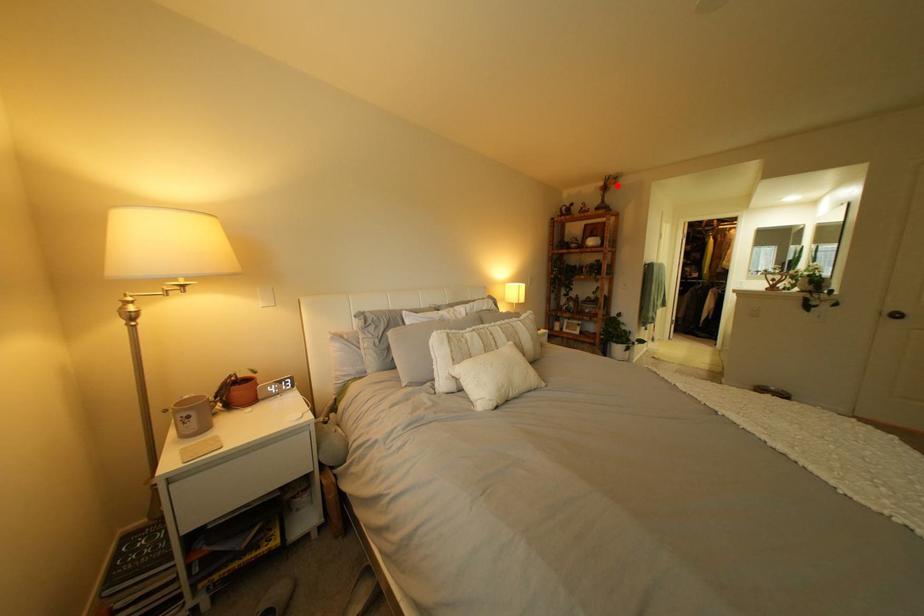
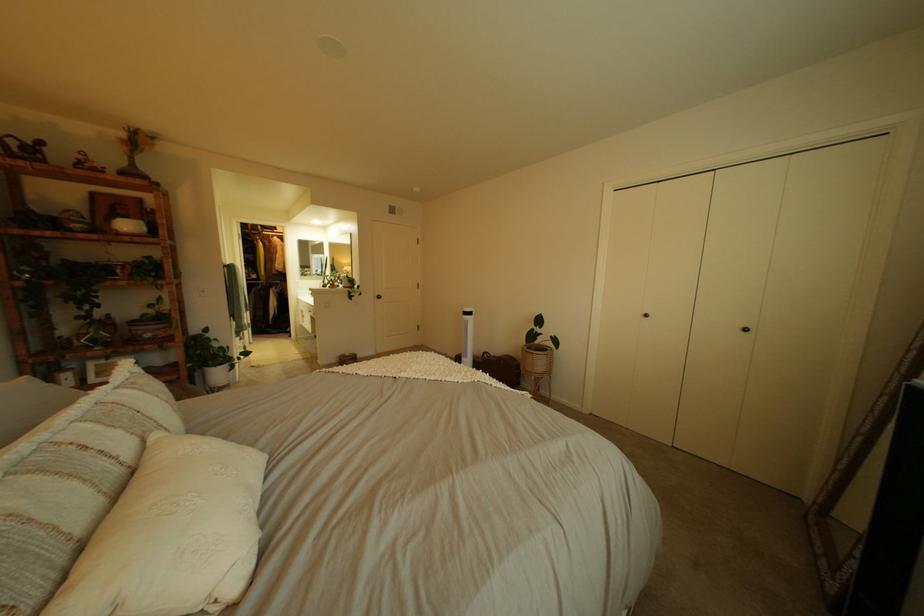
In the second image, find the point that corresponds to the highlighted location in the first image.

(139, 137)